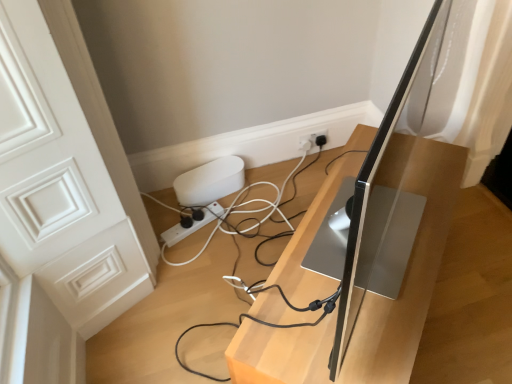
You are a GUI agent. You are given a task and a screenshot of the screen. Output one action in this format:
    pyautogui.click(x=<x>, y=<y>)
    Task: Click on the space that is in front of white plastic power strip at lower center
    This screenshot has width=512, height=384.
    Given the screenshot: What is the action you would take?
    pyautogui.click(x=195, y=262)